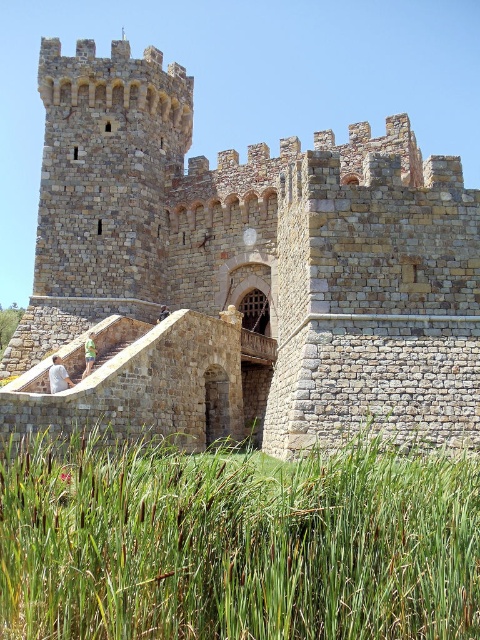
Question: Is brown stone castle at center positioned at the back of green grass at lower center?

Choices:
 (A) no
 (B) yes

Answer: (B)

Question: Which point is farther to the camera?

Choices:
 (A) (408, 413)
 (B) (180, 602)

Answer: (A)

Question: Which point is farther to the camera?

Choices:
 (A) brown stone castle at center
 (B) green grass at lower center

Answer: (A)

Question: Does brown stone castle at center have a greater width compared to green grass at lower center?

Choices:
 (A) no
 (B) yes

Answer: (B)

Question: Is brown stone castle at center positioned at the back of green grass at lower center?

Choices:
 (A) no
 (B) yes

Answer: (B)

Question: Which object is closer to the camera taking this photo?

Choices:
 (A) brown stone castle at center
 (B) green grass at lower center

Answer: (B)